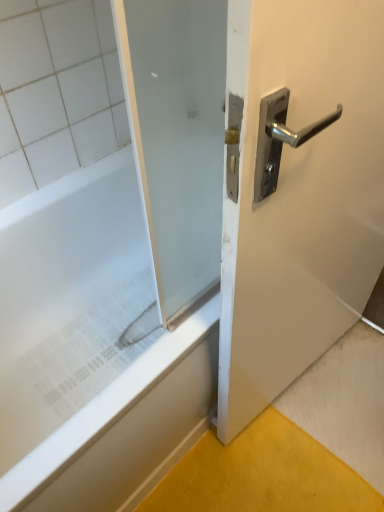
Locate an element on the screen. white glossy bathtub at upper left is located at coordinates (90, 348).

Image resolution: width=384 pixels, height=512 pixels. Describe the element at coordinates (90, 348) in the screenshot. I see `white glossy bathtub at upper left` at that location.

I want to click on white glossy bathtub at upper left, so click(90, 348).